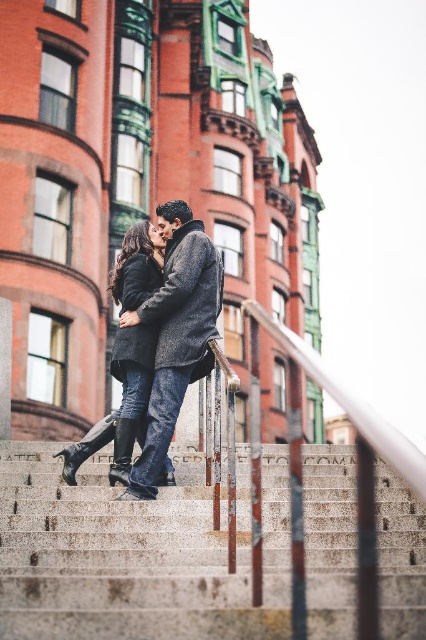
You are a photographer trying to capture the couple in the center of the image. You need to focus on the point at coordinates point (175, 333). Where exactly on the dark gray wool coat at center should you aim your camera?

The point (175, 333) is located on the dark gray wool coat at center, so you should aim your camera at that specific area of the coat to capture the focus point accurately.

You are standing in front of the red brick building and want to place a small decoration at both point [149,552] and point [190,225]. Which point is closer to you?

Point [149,552] is closer to the viewer than point [190,225].

You are a photographer trying to capture the couple in the image. You want to focus on the dark gray wool coat at center and the velvet black coat at center. Which coat is positioned higher on the couple?

The dark gray wool coat at center is located above the velvet black coat at center, so the dark gray wool coat at center is positioned higher on the couple.